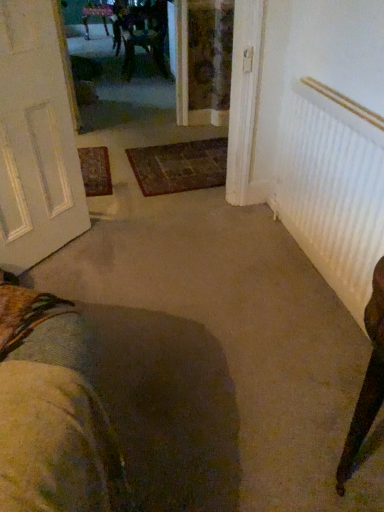
Question: Is wooden chair at upper center closer to camera compared to white ribbed radiator at right?

Choices:
 (A) yes
 (B) no

Answer: (B)

Question: From a real-world perspective, is wooden chair at upper center under white ribbed radiator at right?

Choices:
 (A) yes
 (B) no

Answer: (A)

Question: Could you tell me if wooden chair at upper center is turned towards white ribbed radiator at right?

Choices:
 (A) no
 (B) yes

Answer: (A)

Question: Is wooden chair at upper center bigger than white ribbed radiator at right?

Choices:
 (A) yes
 (B) no

Answer: (A)

Question: From a real-world perspective, does wooden chair at upper center stand above white ribbed radiator at right?

Choices:
 (A) yes
 (B) no

Answer: (B)

Question: Considering the relative positions of wooden chair at upper center and white ribbed radiator at right in the image provided, is wooden chair at upper center to the left or to the right of white ribbed radiator at right?

Choices:
 (A) right
 (B) left

Answer: (B)

Question: In the image, is wooden chair at upper center positioned in front of or behind white ribbed radiator at right?

Choices:
 (A) front
 (B) behind

Answer: (B)

Question: From the image's perspective, relative to white ribbed radiator at right, is wooden chair at upper center above or below?

Choices:
 (A) above
 (B) below

Answer: (A)

Question: In terms of width, does wooden chair at upper center look wider or thinner when compared to white ribbed radiator at right?

Choices:
 (A) thin
 (B) wide

Answer: (B)

Question: Is wooden chair at upper center inside the boundaries of white textured door at left, or outside?

Choices:
 (A) outside
 (B) inside

Answer: (A)

Question: From the image's perspective, relative to white textured door at left, is wooden chair at upper center above or below?

Choices:
 (A) above
 (B) below

Answer: (A)

Question: Considering the positions of wooden chair at upper center and white textured door at left in the image, is wooden chair at upper center bigger or smaller than white textured door at left?

Choices:
 (A) small
 (B) big

Answer: (B)

Question: Is point (144, 14) positioned closer to the camera than point (21, 266)?

Choices:
 (A) farther
 (B) closer

Answer: (A)

Question: In terms of height, does wooden chair at upper center look taller or shorter compared to carpeted doormat at center?

Choices:
 (A) short
 (B) tall

Answer: (B)

Question: From the image's perspective, is wooden chair at upper center located above or below carpeted doormat at center?

Choices:
 (A) above
 (B) below

Answer: (A)